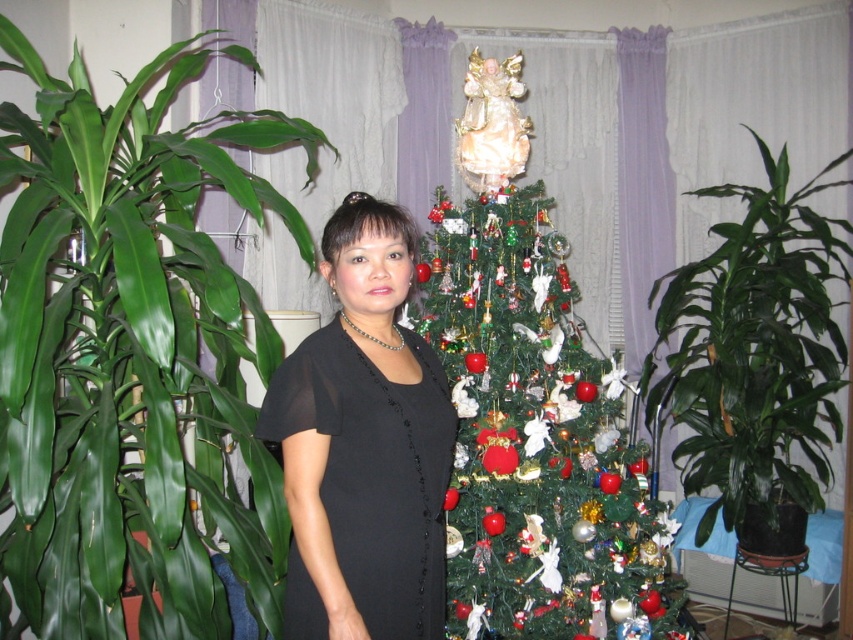
You are standing in the room and want to reach the green glossy leafy plant at left without moving the Christmas tree. Can you estimate if you can comfortably reach it from your current position?

The green glossy leafy plant at left is 1.55 meters away from the viewer, so you can comfortably reach it without moving the Christmas tree.

You are a guest at a Christmas party and want to take a photo with the green glossy leafy plant at left and the green matte christmas tree at center. Which object should you stand closer to if you want both to be in the frame without moving your camera position?

You should stand closer to the green glossy leafy plant at left because it is positioned on the left side of the green matte christmas tree at center, so moving closer to it will help keep both in the frame without needing to adjust the camera angle.